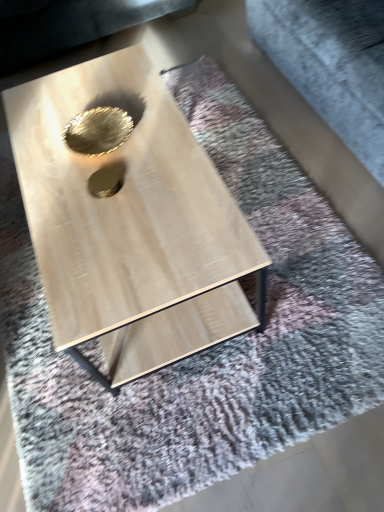
Question: From a real-world perspective, is gray fabric at upper right above or below gold metallic hole at center, the second hole positioned from the front?

Choices:
 (A) below
 (B) above

Answer: (A)

Question: Would you say gray fabric at upper right is to the left or to the right of gold metallic hole at center, which appears as the 2th hole when ordered from the bottom, in the picture?

Choices:
 (A) left
 (B) right

Answer: (B)

Question: Which of these objects is positioned closest to the gold metallic hole at center, placed as the 1th hole when sorted from bottom to top?

Choices:
 (A) gold metallic hole at center, which is the 1th hole from top to bottom
 (B) light wood/texture coffee table at center
 (C) gray fabric at upper right

Answer: (A)

Question: Which is farther from the gold metallic hole at center, which is the 1th hole from top to bottom?

Choices:
 (A) gold metallic hole at center, placed as the 1th hole when sorted from bottom to top
 (B) light wood/texture coffee table at center
 (C) gray fabric at upper right

Answer: (C)